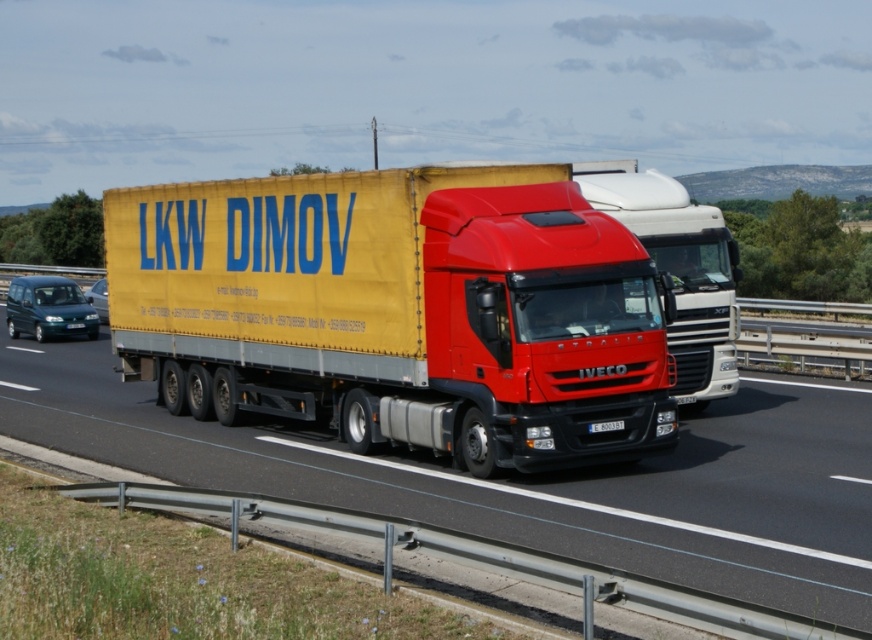
Does yellow fabric trailer truck at center have a greater width compared to red matte truck at center?

Yes, yellow fabric trailer truck at center is wider than red matte truck at center.

Is yellow fabric trailer truck at center behind red matte truck at center?

No.

Find the location of a particular element. This screenshot has width=872, height=640. yellow fabric trailer truck at center is located at coordinates (397, 310).

Identify the location of yellow fabric trailer truck at center. (397, 310).

Who is taller, yellow fabric trailer at center or black plastic license plate at center?

yellow fabric trailer at center is taller.

Between yellow fabric trailer at center and black plastic license plate at center, which one has less height?

black plastic license plate at center

Between point (594, 476) and point (604, 426), which one is positioned behind?

Positioned behind is point (594, 476).

Where is `yellow fabric trailer at center`? The width and height of the screenshot is (872, 640). yellow fabric trailer at center is located at coordinates (526, 477).

Is teal glossy van at left taller than metallic blue van at left?

Correct, teal glossy van at left is much taller as metallic blue van at left.

Between point (12, 307) and point (94, 300), which one is positioned in front?

Positioned in front is point (12, 307).

Where is `teal glossy van at left`? teal glossy van at left is located at coordinates (48, 308).